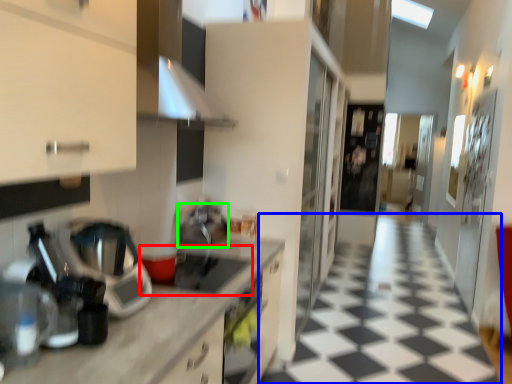
Question: Which is farther away from gas stove (highlighted by a red box)? tile (highlighted by a blue box) or appliance (highlighted by a green box)?

Choices:
 (A) tile
 (B) appliance

Answer: (A)